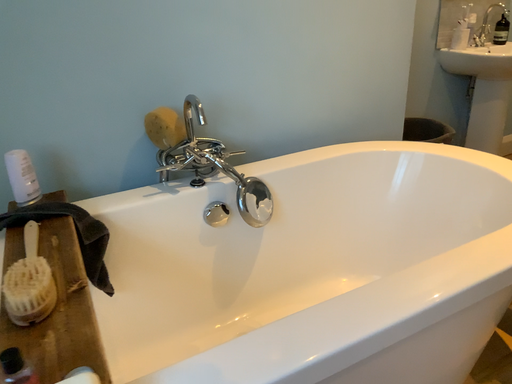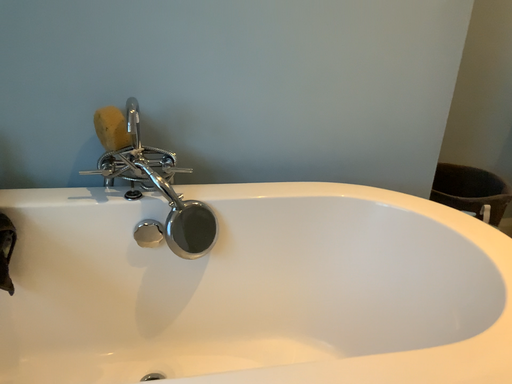
Question: How did the camera likely rotate when shooting the video?

Choices:
 (A) rotated left
 (B) rotated right

Answer: (A)